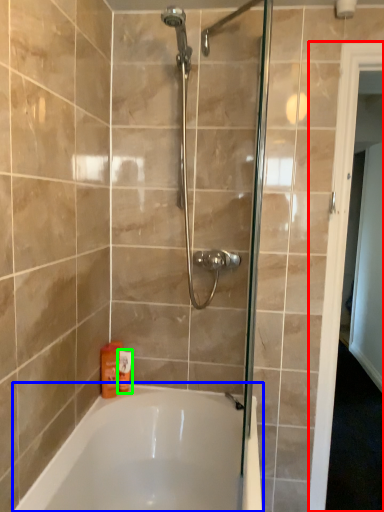
Question: Based on their relative distances, which object is farther from screen door (highlighted by a red box)? Choose from bathtub (highlighted by a blue box) and toiletry (highlighted by a green box).

Choices:
 (A) bathtub
 (B) toiletry

Answer: (B)